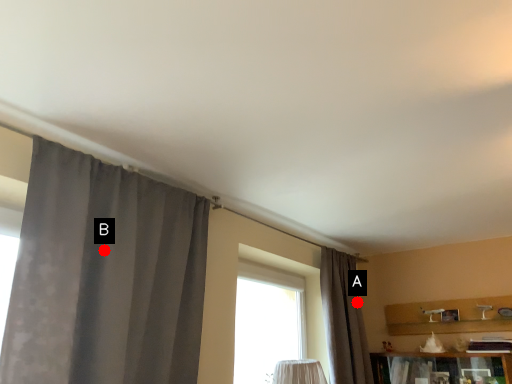
Question: Two points are circled on the image, labeled by A and B beside each circle. Among these points, which one is nearest to the camera?

Choices:
 (A) A is closer
 (B) B is closer

Answer: (B)